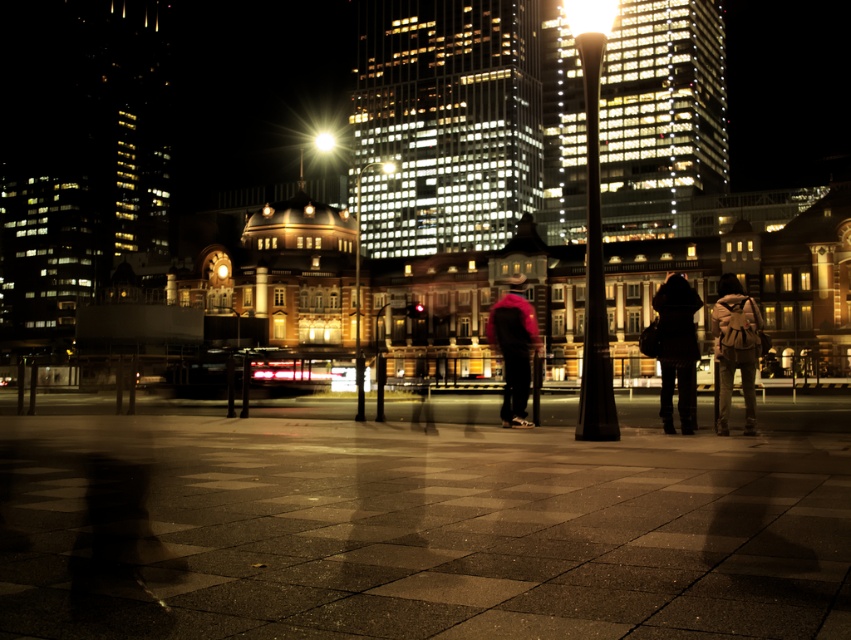
Who is taller, smooth concrete pavement at center or dark matte coat at center?

With more height is dark matte coat at center.

Is smooth concrete pavement at center to the right of dark matte coat at center from the viewer's perspective?

Incorrect, smooth concrete pavement at center is not on the right side of dark matte coat at center.

Who is more distant from viewer, (390,499) or (686,401)?

Point (686,401)

You are a GUI agent. You are given a task and a screenshot of the screen. Output one action in this format:
    pyautogui.click(x=<x>, y=<y>)
    Task: Click on the smooth concrete pavement at center
    This screenshot has width=851, height=640.
    Given the screenshot: What is the action you would take?
    pyautogui.click(x=420, y=522)

Does smooth concrete pavement at center appear over brown leather backpack at center?

Incorrect, smooth concrete pavement at center is not positioned above brown leather backpack at center.

Between point (842, 438) and point (752, 353), which one is positioned in front?

Positioned in front is point (842, 438).

I want to click on smooth concrete pavement at center, so click(420, 522).

Identify the location of smooth concrete pavement at center. (420, 522).

Can you confirm if dark matte coat at center is shorter than velvet pink sweater at center?

Yes, dark matte coat at center is shorter than velvet pink sweater at center.

Which of these two, dark matte coat at center or velvet pink sweater at center, stands taller?

velvet pink sweater at center

Between point (660, 323) and point (513, 291), which one is positioned in front?

Point (660, 323) is more forward.

You are a GUI agent. You are given a task and a screenshot of the screen. Output one action in this format:
    pyautogui.click(x=<x>, y=<y>)
    Task: Click on the dark matte coat at center
    This screenshot has height=640, width=851.
    Given the screenshot: What is the action you would take?
    pyautogui.click(x=677, y=348)